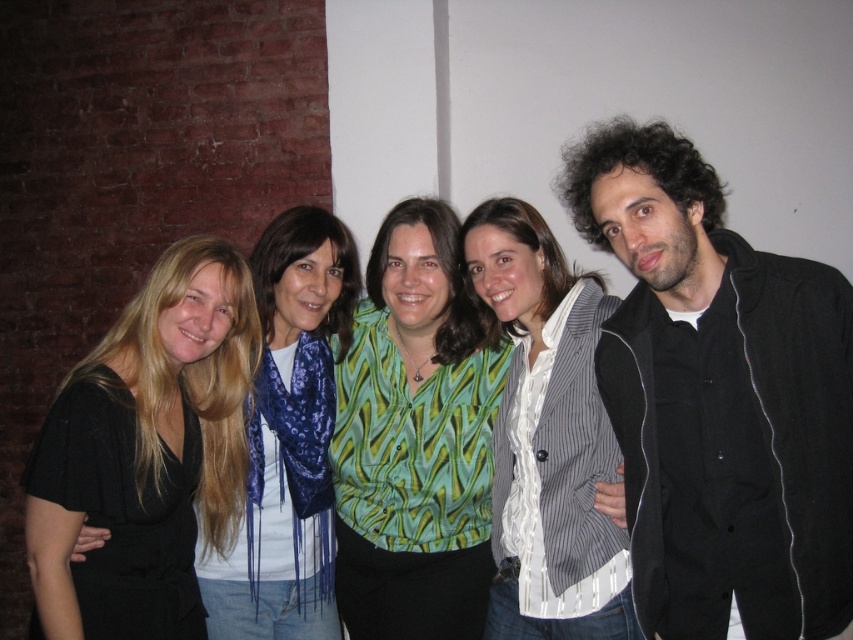
Does black matte jacket at center appear over green printed blouse at center?

Indeed, black matte jacket at center is positioned over green printed blouse at center.

Is point (680, 518) farther from camera compared to point (410, 461)?

That is False.

The height and width of the screenshot is (640, 853). I want to click on black matte jacket at center, so click(718, 397).

Is point (194, 529) farther from viewer compared to point (427, 388)?

No, it is not.

Image resolution: width=853 pixels, height=640 pixels. I want to click on black matte dress at left, so click(x=148, y=451).

Image resolution: width=853 pixels, height=640 pixels. Find the location of `black matte dress at left`. black matte dress at left is located at coordinates (148, 451).

Is black matte dress at left smaller than striped fabric shirt at center?

Incorrect, black matte dress at left is not smaller in size than striped fabric shirt at center.

Measure the distance between point (38,548) and camera.

Point (38,548) and camera are 5.40 feet apart.

Does point (158, 621) lie behind point (543, 637)?

No.

Find the location of a particular element. The width and height of the screenshot is (853, 640). black matte dress at left is located at coordinates (148, 451).